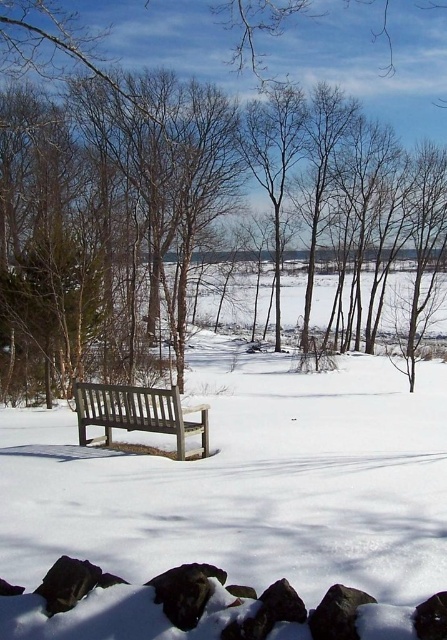
Based on the photo, you are standing in the winter scene and want to sit on the bench that is to the left. Which bench should you choose between the white matte bench at center and the wooden bench at center?

The wooden bench at center is to the left of the white matte bench at center, so you should choose the wooden bench at center to sit on.

You are an artist setting up an easel to paint the winter scene. You want to place your easel between the brown wood bench at lower left and the wooden bench at center. Which bench should you position the easel closer to if you want it to be closer to the larger bench?

The brown wood bench at lower left is bigger than the wooden bench at center. Therefore, you should position the easel closer to the brown wood bench at lower left to be nearer to the larger bench.